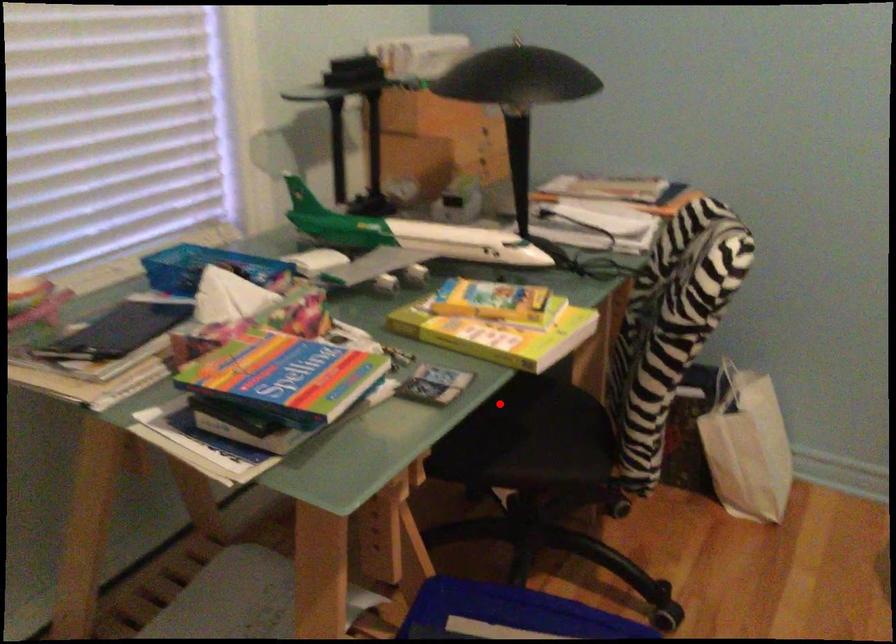
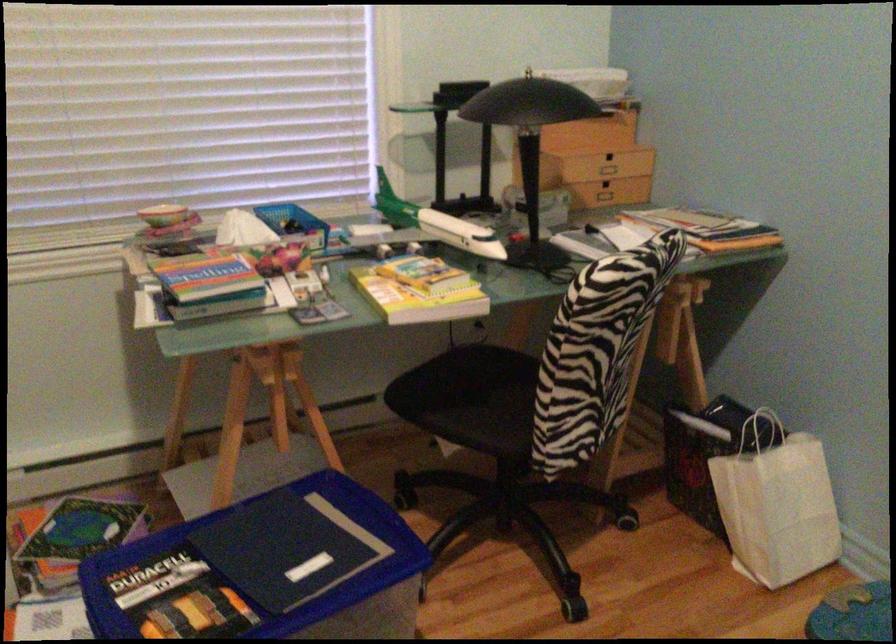
Question: I am providing you with two images of the same scene from different viewpoints. A red point is shown in image1. For the corresponding object point in image2, is it positioned nearer or farther from the camera?

Choices:
 (A) Nearer
 (B) Farther

Answer: (B)